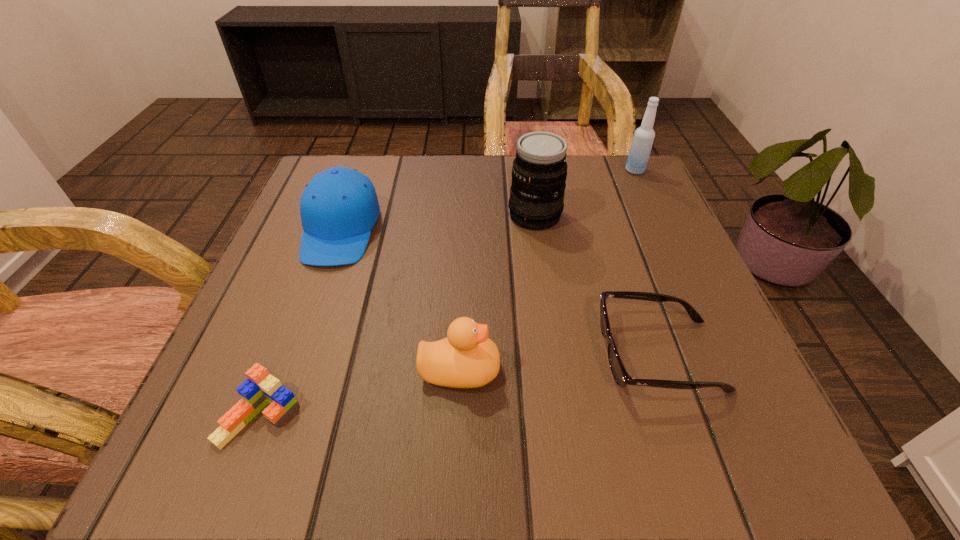
Identify the location of vacant space at the near left corner of the desktop. This screenshot has width=960, height=540. (256, 459).

In the image, there is a desktop. In order to click on vacant space at the far right corner in this screenshot , I will do coord(595,169).

I want to click on free space between the Lego and the third object from left to right, so click(359, 393).

Image resolution: width=960 pixels, height=540 pixels. I want to click on free space between the Lego and the cap, so click(x=300, y=323).

At what (x,y) coordinates should I click in order to perform the action: click on blank region between the cap and the farthest object. Please return your answer as a coordinate pair (x, y). The width and height of the screenshot is (960, 540). Looking at the image, I should click on (488, 200).

This screenshot has height=540, width=960. Find the location of `free space between the spectacles and the fourth object from left to right`. free space between the spectacles and the fourth object from left to right is located at coordinates (597, 286).

The height and width of the screenshot is (540, 960). I want to click on free space between the spectacles and the duck, so click(560, 362).

Locate an element on the screen. This screenshot has width=960, height=540. empty space between the cap and the spectacles is located at coordinates (499, 293).

The width and height of the screenshot is (960, 540). What are the coordinates of `free spot between the telephoto lens and the Lego` in the screenshot? It's located at (397, 316).

At what (x,y) coordinates should I click in order to perform the action: click on free space between the spectacles and the bottle. Please return your answer as a coordinate pair (x, y). Looking at the image, I should click on (647, 263).